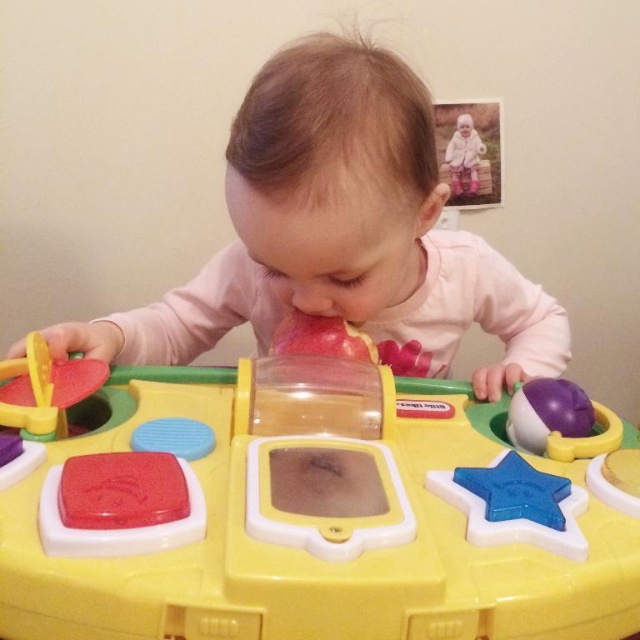
Question: Among these objects, which one is farthest from the camera?

Choices:
 (A) pink matte toy at center
 (B) white matte baby at upper right
 (C) yellow plastic toy at center

Answer: (B)

Question: Which of the following is the closest to the observer?

Choices:
 (A) yellow plastic toy at center
 (B) pink matte toy at center
 (C) white matte baby at upper right

Answer: (A)

Question: Is yellow plastic toy at center positioned behind pink matte toy at center?

Choices:
 (A) yes
 (B) no

Answer: (B)

Question: Is yellow plastic toy at center bigger than pink matte toy at center?

Choices:
 (A) yes
 (B) no

Answer: (B)

Question: Which of the following is the closest to the observer?

Choices:
 (A) coord(301,193)
 (B) coord(451,176)

Answer: (A)

Question: Does pink matte toy at center appear over white matte baby at upper right?

Choices:
 (A) no
 (B) yes

Answer: (A)